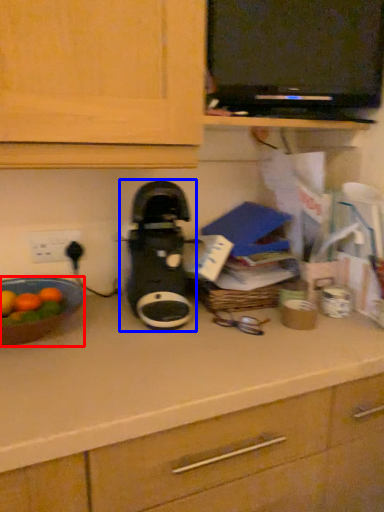
Question: Which point is closer to the camera, kitchen appliance (highlighted by a red box) or home appliance (highlighted by a blue box)?

Choices:
 (A) kitchen appliance
 (B) home appliance

Answer: (A)